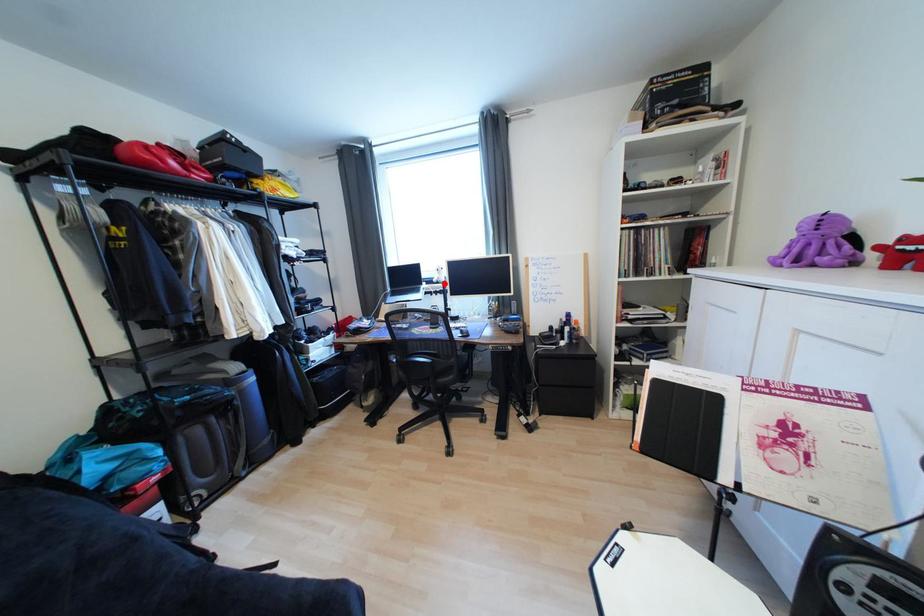
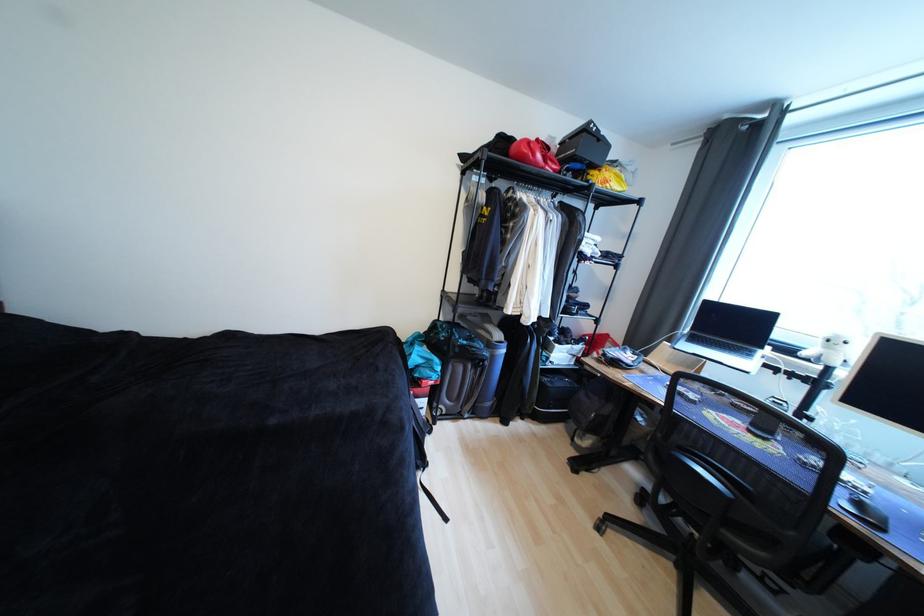
Find the pixel in the second image that matches the highlighted location in the first image.

(812, 361)